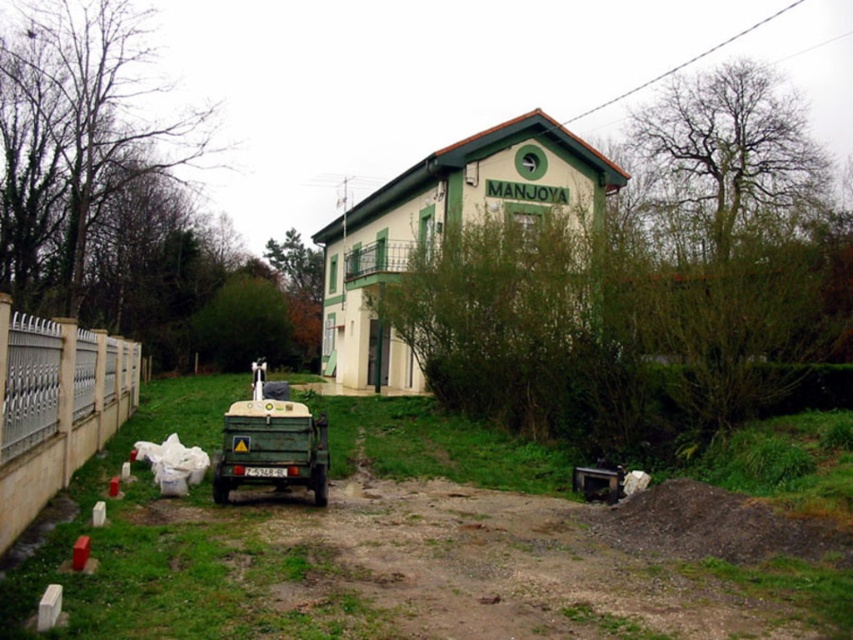
Question: Does white metal fence at lower left have a smaller size compared to green matte truck at lower left?

Choices:
 (A) no
 (B) yes

Answer: (B)

Question: Is white metal fence at lower left below green matte truck at lower left?

Choices:
 (A) no
 (B) yes

Answer: (A)

Question: Which point is farther to the camera?

Choices:
 (A) (279, 392)
 (B) (21, 499)

Answer: (A)

Question: Among these points, which one is nearest to the camera?

Choices:
 (A) (312, 429)
 (B) (26, 358)

Answer: (B)

Question: Does white metal fence at lower left appear on the left side of green matte truck at lower left?

Choices:
 (A) no
 (B) yes

Answer: (B)